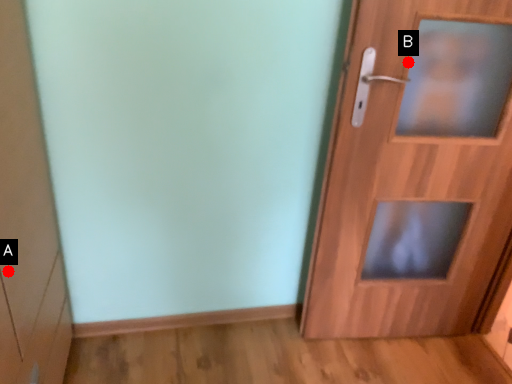
Question: Two points are circled on the image, labeled by A and B beside each circle. Which point is farther to the camera?

Choices:
 (A) A is further
 (B) B is further

Answer: (B)